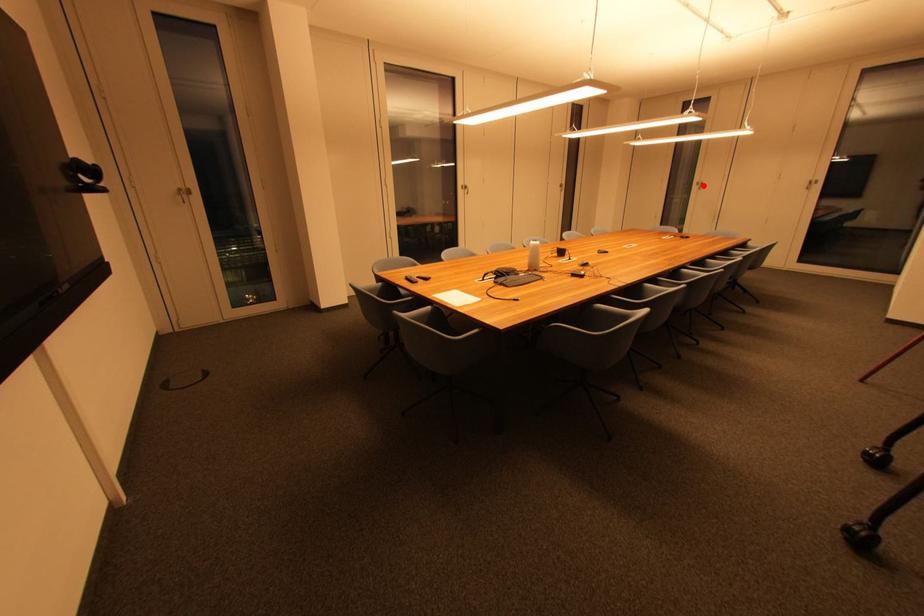
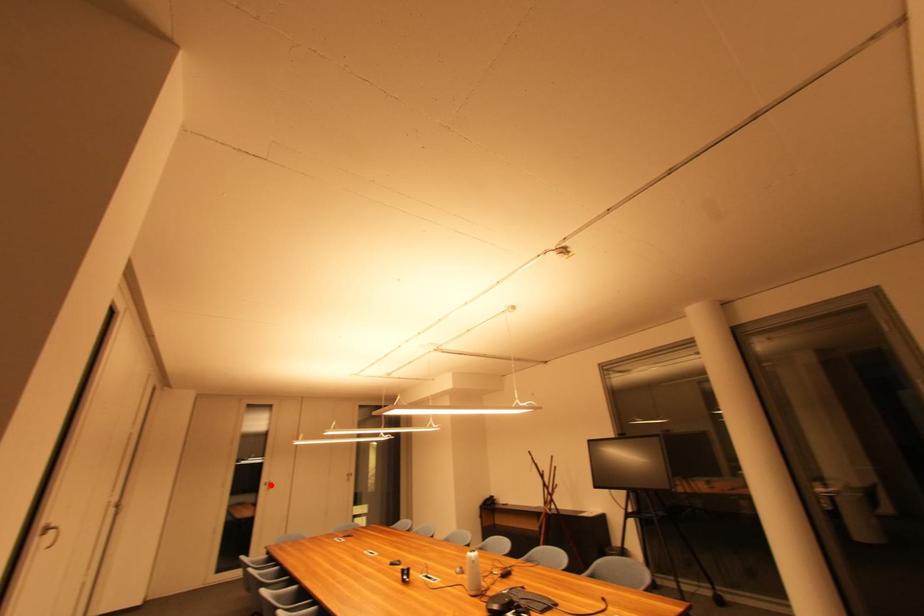
I am providing you with two images of the same scene from different viewpoints. A red point is marked on the first image and another point is marked on the second image. Do the highlighted points in image1 and image2 indicate the same real-world spot?

Yes